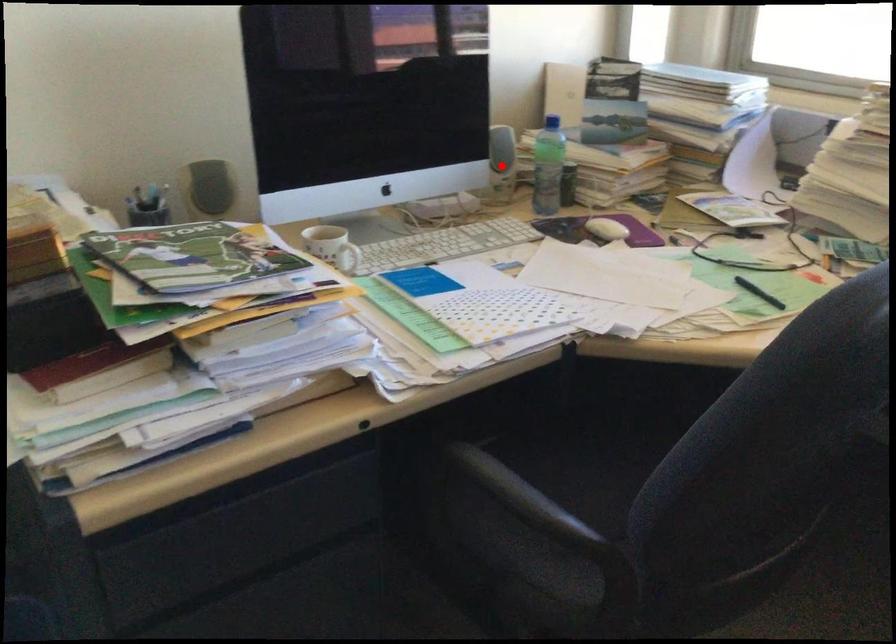
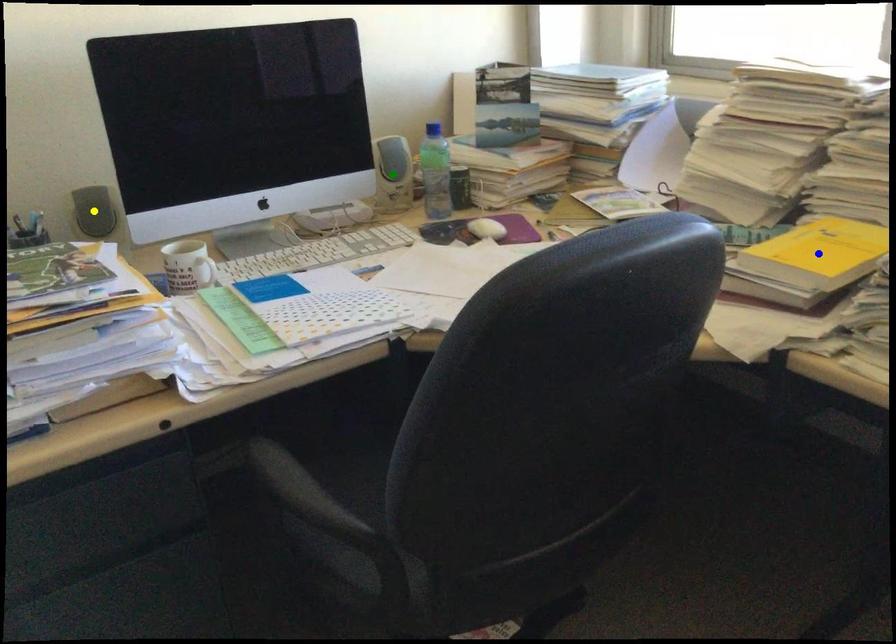
Question: I am providing you with two images of the same scene from different viewpoints. A red point is marked on the first image. You are given multiple points on the second image. Can you choose the point in image 2 that corresponds to the point in image 1?

Choices:
 (A) blue point
 (B) green point
 (C) yellow point

Answer: (B)